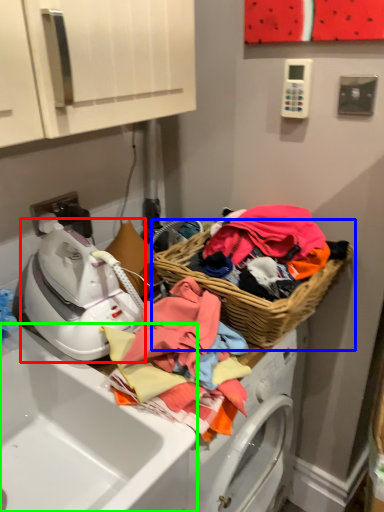
Question: Based on their relative distances, which object is nearer to washer (highlighted by a red box)? Choose from picnic basket (highlighted by a blue box) and sink (highlighted by a green box).

Choices:
 (A) picnic basket
 (B) sink

Answer: (B)